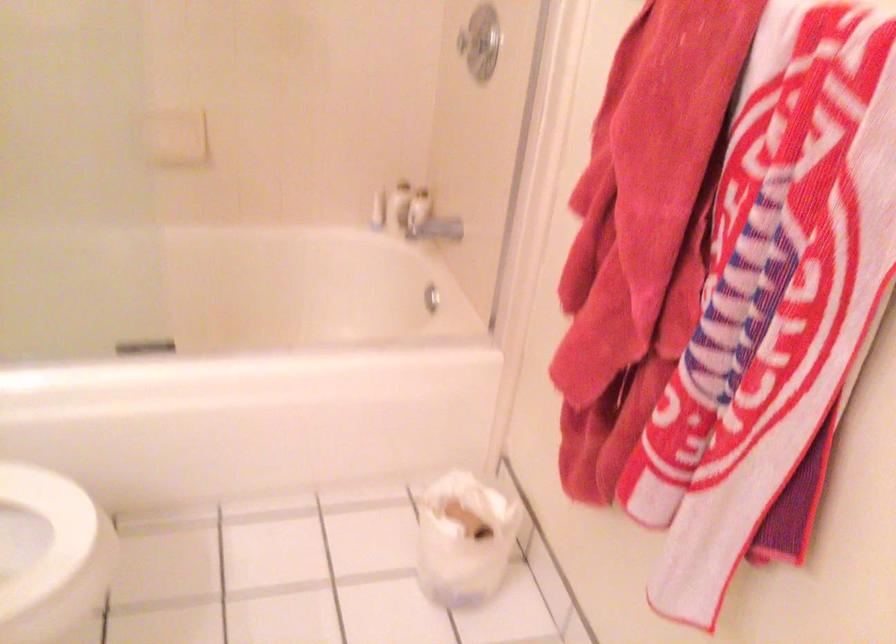
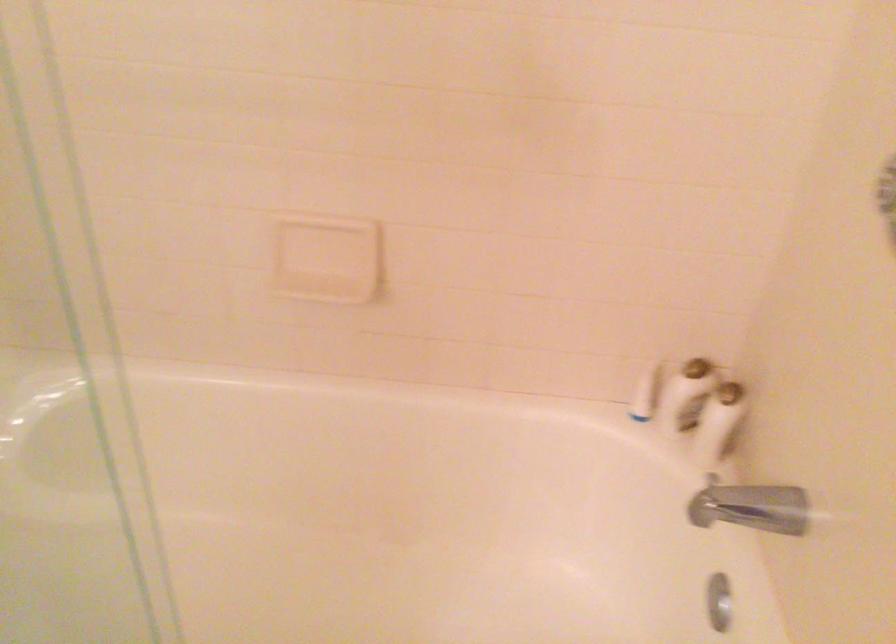
The point at (380,205) is marked in the first image. Where is the corresponding point in the second image?

(644, 393)